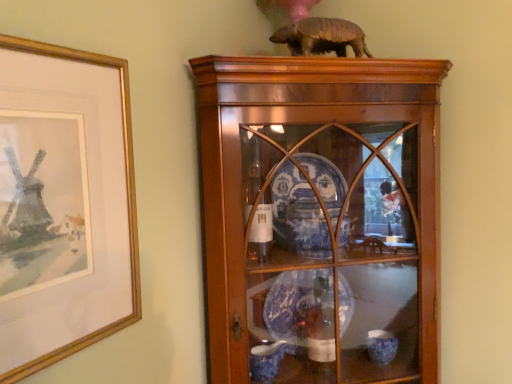
Question: From a real-world perspective, is brown matte armadillo at upper center on top of gold-framed picture at left?

Choices:
 (A) no
 (B) yes

Answer: (B)

Question: Is gold-framed picture at left a part of brown matte armadillo at upper center?

Choices:
 (A) no
 (B) yes

Answer: (A)

Question: From the image's perspective, is brown matte armadillo at upper center on gold-framed picture at left?

Choices:
 (A) yes
 (B) no

Answer: (A)

Question: From the image's perspective, is brown matte armadillo at upper center located beneath gold-framed picture at left?

Choices:
 (A) no
 (B) yes

Answer: (A)

Question: Is brown matte armadillo at upper center facing away from gold-framed picture at left?

Choices:
 (A) no
 (B) yes

Answer: (A)

Question: From a real-world perspective, is brown matte armadillo at upper center physically located above or below gold-framed picture at left?

Choices:
 (A) below
 (B) above

Answer: (B)

Question: From the image's perspective, is brown matte armadillo at upper center above or below gold-framed picture at left?

Choices:
 (A) above
 (B) below

Answer: (A)

Question: Looking at their shapes, would you say brown matte armadillo at upper center is wider or thinner than gold-framed picture at left?

Choices:
 (A) wide
 (B) thin

Answer: (A)

Question: Is brown matte armadillo at upper center bigger or smaller than gold-framed picture at left?

Choices:
 (A) big
 (B) small

Answer: (B)

Question: In terms of width, does wooden cabinet at center look wider or thinner when compared to brown matte armadillo at upper center?

Choices:
 (A) thin
 (B) wide

Answer: (B)

Question: In terms of size, does wooden cabinet at center appear bigger or smaller than brown matte armadillo at upper center?

Choices:
 (A) small
 (B) big

Answer: (B)

Question: Would you say wooden cabinet at center is to the left or to the right of brown matte armadillo at upper center in the picture?

Choices:
 (A) right
 (B) left

Answer: (A)

Question: Is wooden cabinet at center situated inside brown matte armadillo at upper center or outside?

Choices:
 (A) inside
 (B) outside

Answer: (B)

Question: Do you think wooden cabinet at center is within gold-framed picture at left, or outside of it?

Choices:
 (A) outside
 (B) inside

Answer: (A)

Question: Considering the positions of wooden cabinet at center and gold-framed picture at left in the image, is wooden cabinet at center wider or thinner than gold-framed picture at left?

Choices:
 (A) thin
 (B) wide

Answer: (B)